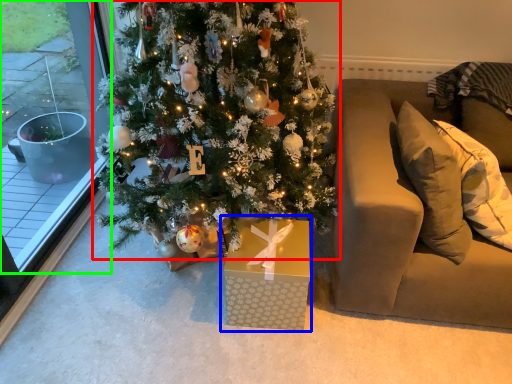
Question: Considering the real-world distances, which object is farthest from christmas tree (highlighted by a red box)? gift box (highlighted by a blue box) or window (highlighted by a green box)?

Choices:
 (A) gift box
 (B) window

Answer: (B)